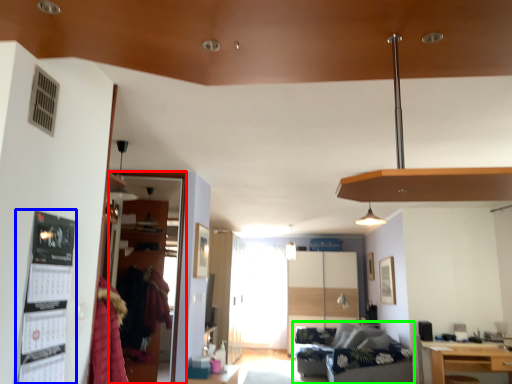
Question: Which object is positioned closest to glass door (highlighted by a red box)? Select from bulletin board (highlighted by a blue box) and studio couch (highlighted by a green box).

Choices:
 (A) bulletin board
 (B) studio couch

Answer: (A)